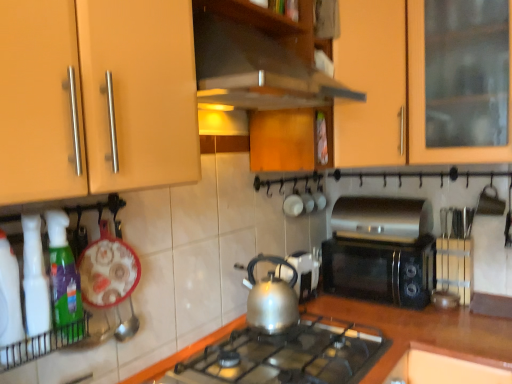
This screenshot has height=384, width=512. Find the location of `vacant area that is in front of silver metallic kettle at center, arranged as the 2th kitchen appliance when viewed from the right`. vacant area that is in front of silver metallic kettle at center, arranged as the 2th kitchen appliance when viewed from the right is located at coordinates pos(250,346).